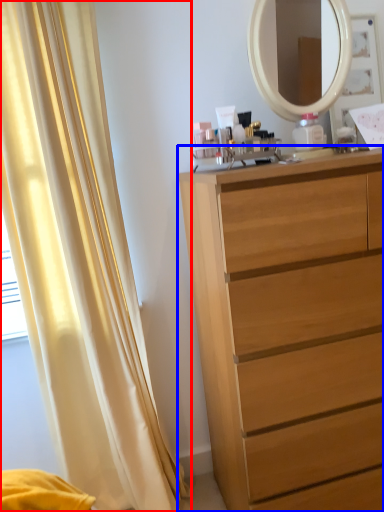
Question: Which of the following is the farthest to the observer, curtain (highlighted by a red box) or chest of drawers (highlighted by a blue box)?

Choices:
 (A) curtain
 (B) chest of drawers

Answer: (A)